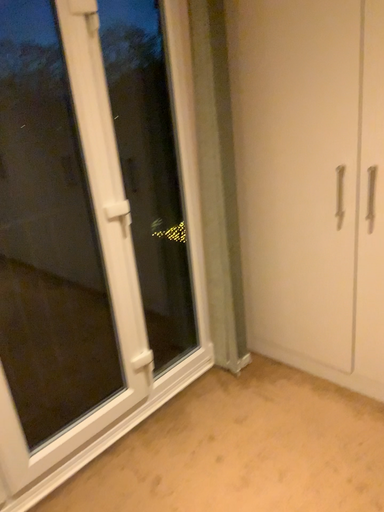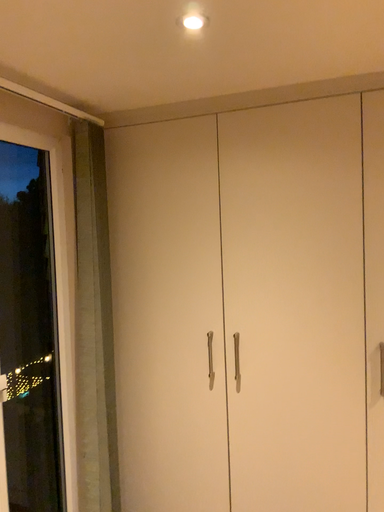
Question: How did the camera likely rotate when shooting the video?

Choices:
 (A) rotated downward
 (B) rotated upward

Answer: (B)